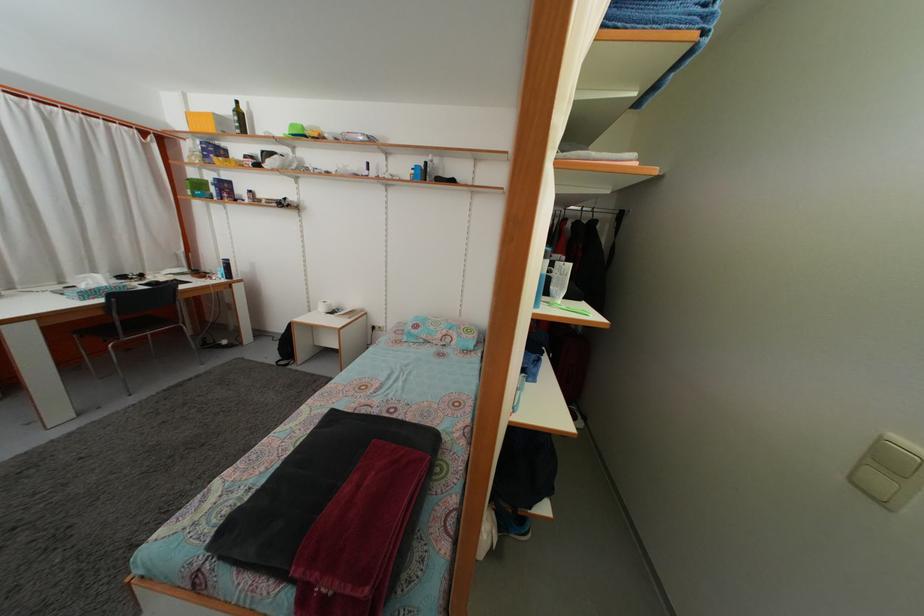
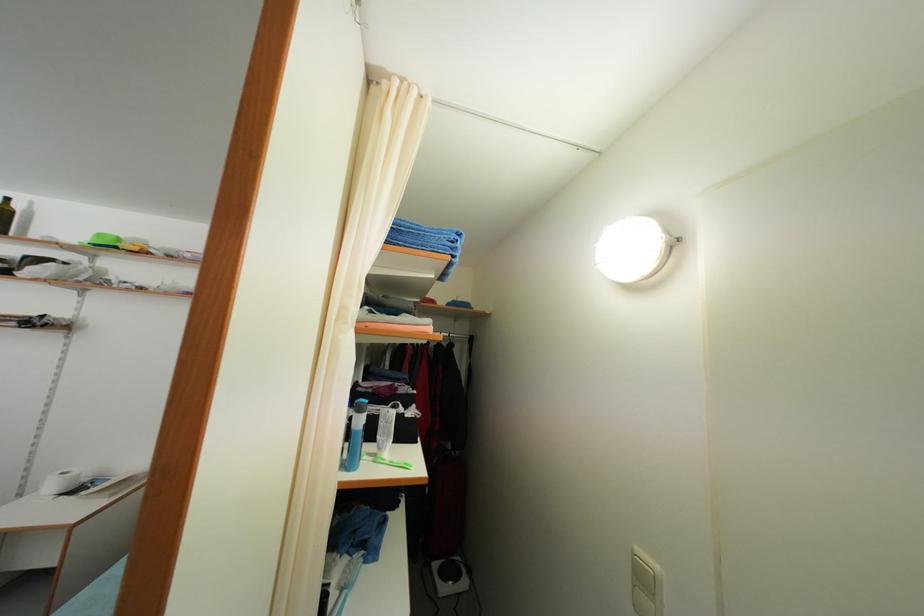
In the second image, find the point that corresponds to point 298,132 in the first image.

(104, 243)